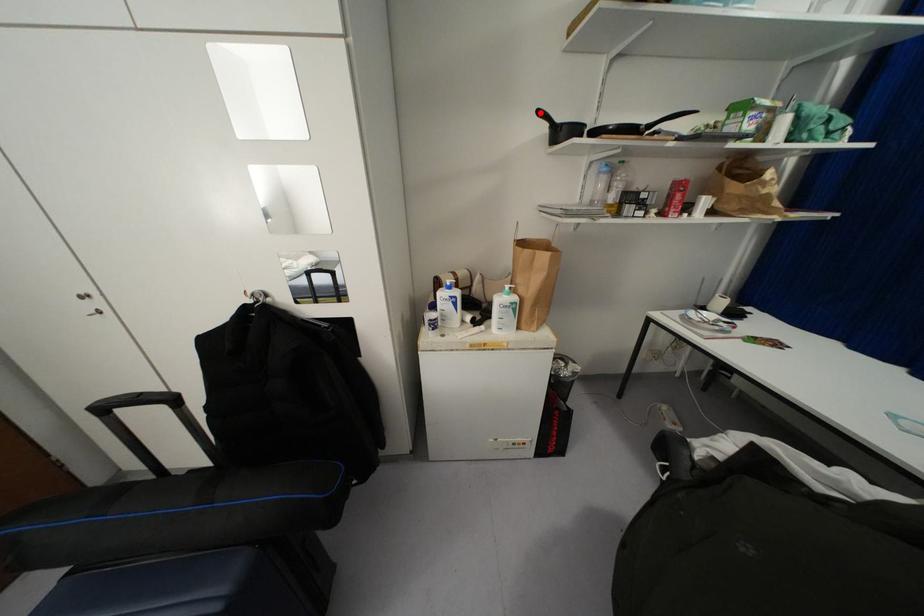
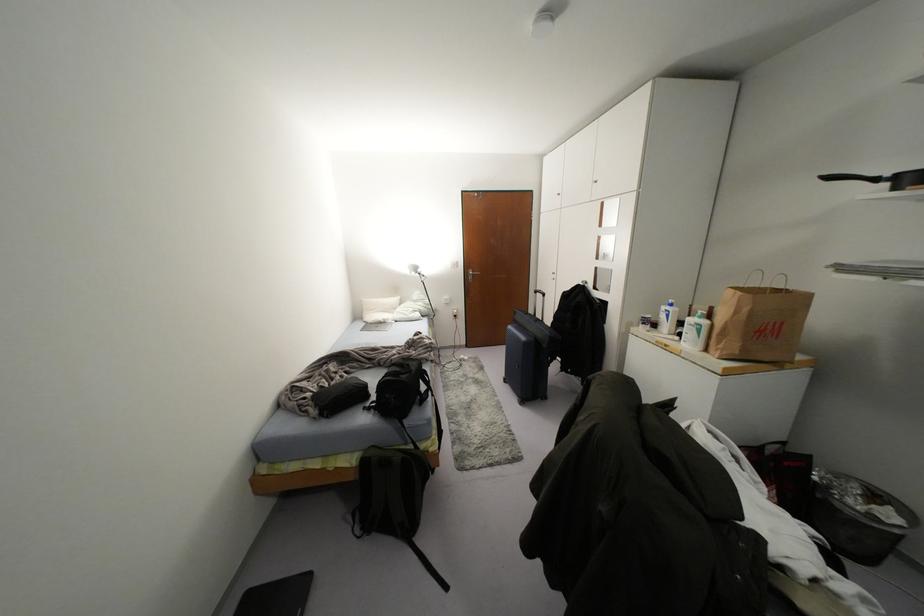
The point at the highlighted location is marked in the first image. Where is the corresponding point in the second image?

(829, 177)